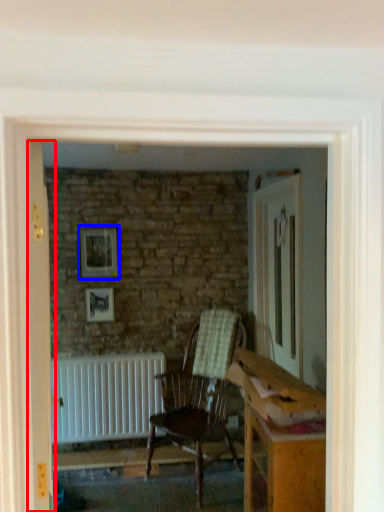
Question: Which object is further to the camera taking this photo, door (highlighted by a red box) or picture frame (highlighted by a blue box)?

Choices:
 (A) door
 (B) picture frame

Answer: (B)